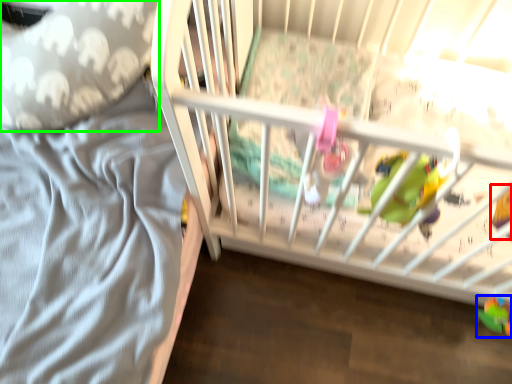
Question: Which is farther away from toy (highlighted by a red box)? toy (highlighted by a blue box) or throw pillow (highlighted by a green box)?

Choices:
 (A) toy
 (B) throw pillow

Answer: (B)